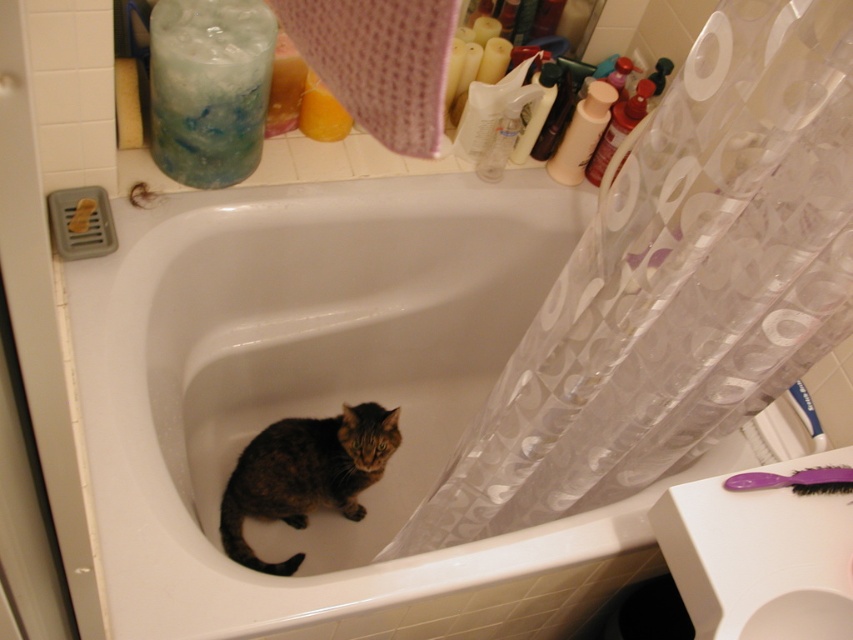
You are trying to decide whether to place a small potted plant on the edge of the bathtub. The plant requires at least 30 cm of vertical space to grow properly. Given the clear plastic shower curtain at right and the tabby fur cat at center, which object might interfere with the plant reaching its full height?

The clear plastic shower curtain at right has a greater height compared to the tabby fur cat at center. Since the shower curtain is taller, it could potentially interfere with the plant reaching its full height of 30 cm if placed near it.